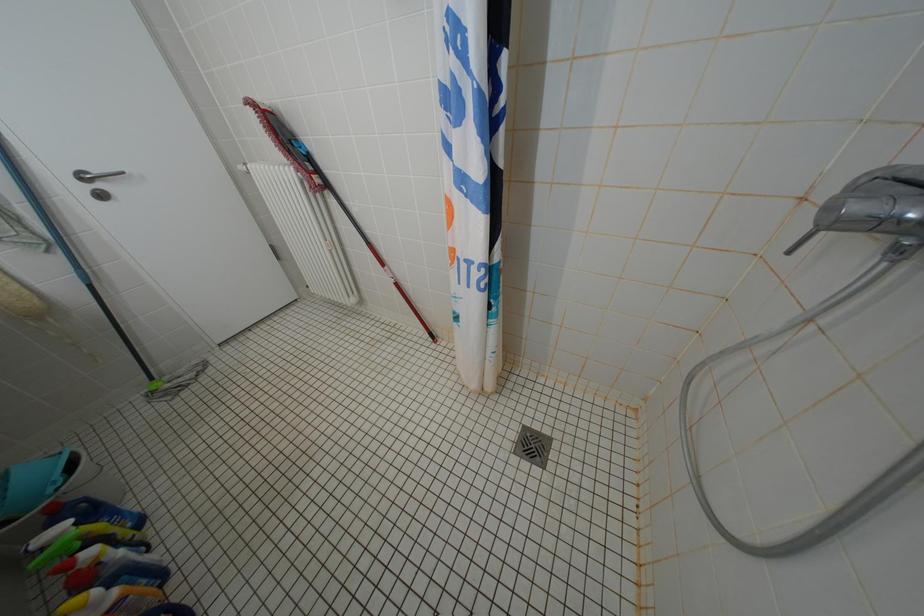
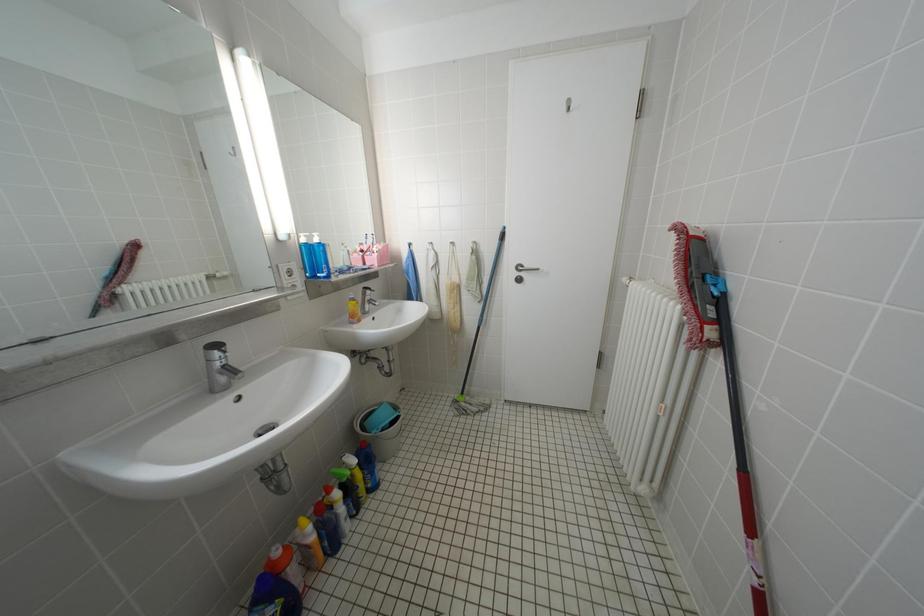
Question: The camera is either moving clockwise (left) or counter-clockwise (right) around the object. The first image is from the beginning of the video and the second image is from the end. Is the camera moving left or right when shooting the video?

Choices:
 (A) Left
 (B) Right

Answer: (B)